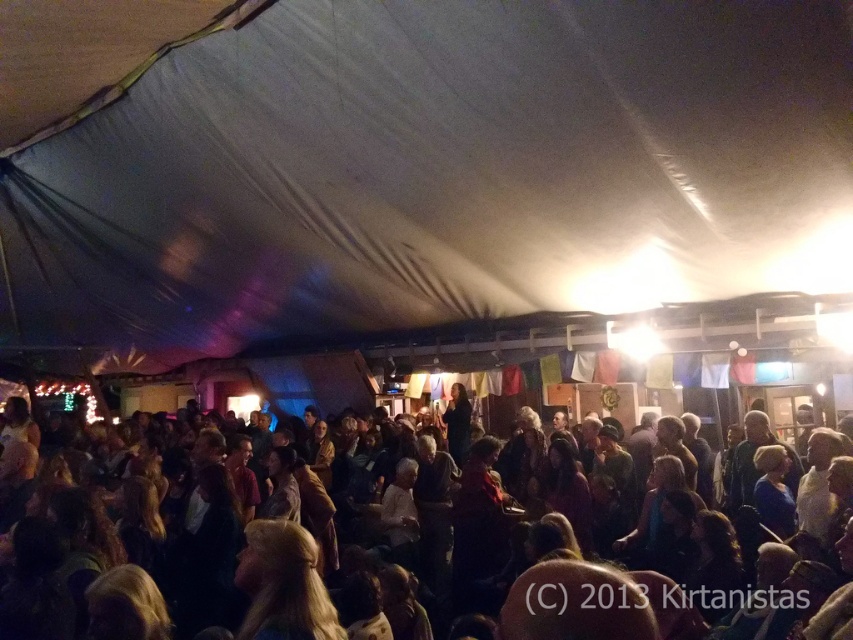
Question: Which point is closer to the camera?

Choices:
 (A) white fabric tent at center
 (B) dark brown hair at lower center

Answer: (B)

Question: Is white fabric tent at center bigger than dark brown hair at lower center?

Choices:
 (A) no
 (B) yes

Answer: (B)

Question: Which point is farther to the camera?

Choices:
 (A) (74, 592)
 (B) (387, 186)

Answer: (B)

Question: Which point is closer to the camera?

Choices:
 (A) (310, 545)
 (B) (526, 262)

Answer: (A)

Question: Can you confirm if white fabric tent at center is positioned below dark brown hair at lower center?

Choices:
 (A) no
 (B) yes

Answer: (A)

Question: Is white fabric tent at center to the right of dark brown hair at lower center from the viewer's perspective?

Choices:
 (A) no
 (B) yes

Answer: (A)